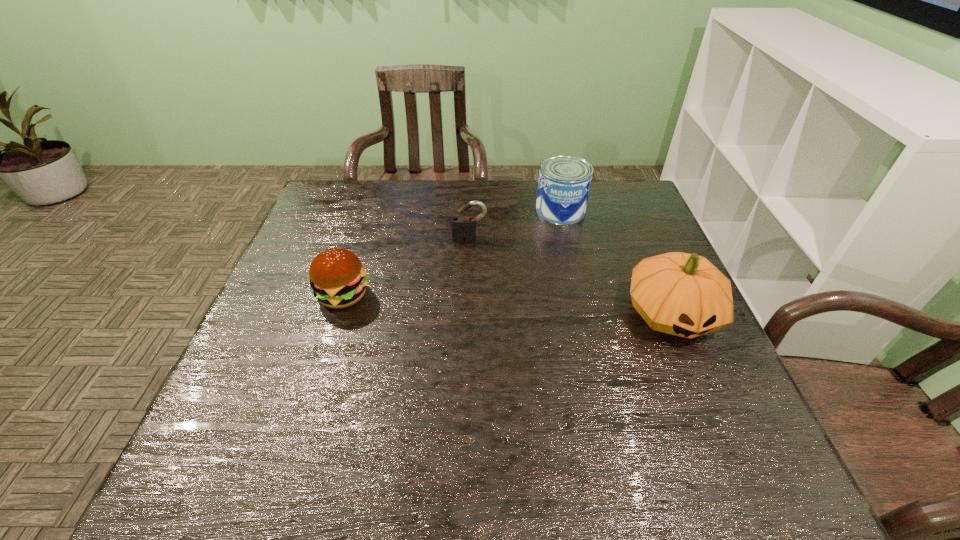
The width and height of the screenshot is (960, 540). I want to click on vacant area located 0.090m on the front label of the second tallest object, so click(546, 241).

The width and height of the screenshot is (960, 540). What are the coordinates of `free point located on the front label of the second tallest object` in the screenshot? It's located at (512, 318).

The height and width of the screenshot is (540, 960). What are the coordinates of `vacant space situated 0.400m with the keyhole on the front of the second object from left to right` in the screenshot? It's located at (465, 356).

You are a GUI agent. You are given a task and a screenshot of the screen. Output one action in this format:
    pyautogui.click(x=<x>, y=<y>)
    Task: Click on the vacant space located with the keyhole on the front of the second object from left to right
    The width and height of the screenshot is (960, 540).
    Given the screenshot: What is the action you would take?
    pyautogui.click(x=466, y=338)

Where is `vacant position located with the keyhole on the front of the second object from left to right`? This screenshot has width=960, height=540. vacant position located with the keyhole on the front of the second object from left to right is located at coordinates (468, 280).

Identify the location of object at the far edge. The height and width of the screenshot is (540, 960). (564, 182).

In order to click on object that is at the left edge in this screenshot , I will do `click(337, 278)`.

Find the location of a particular element. This screenshot has height=540, width=960. object located in the right edge section of the desktop is located at coordinates (682, 294).

This screenshot has height=540, width=960. I want to click on vacant space at the far edge of the desktop, so pyautogui.click(x=420, y=210).

The image size is (960, 540). Identify the location of vacant space at the near edge of the desktop. (643, 395).